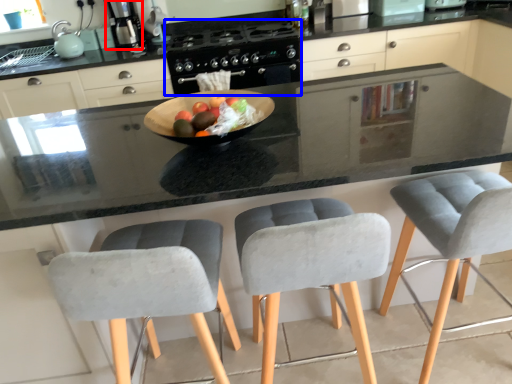
Question: Which object is further to the camera taking this photo, kitchen appliance (highlighted by a red box) or gas stove (highlighted by a blue box)?

Choices:
 (A) kitchen appliance
 (B) gas stove

Answer: (A)